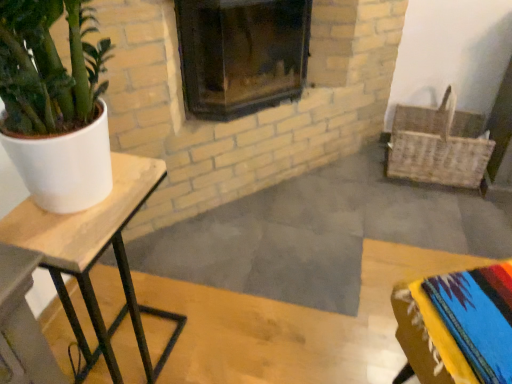
At what (x,y) coordinates should I click in order to perform the action: click on blank space above wooden table at left (from a real-world perspective). Please return your answer as a coordinate pair (x, y). Looking at the image, I should click on (78, 211).